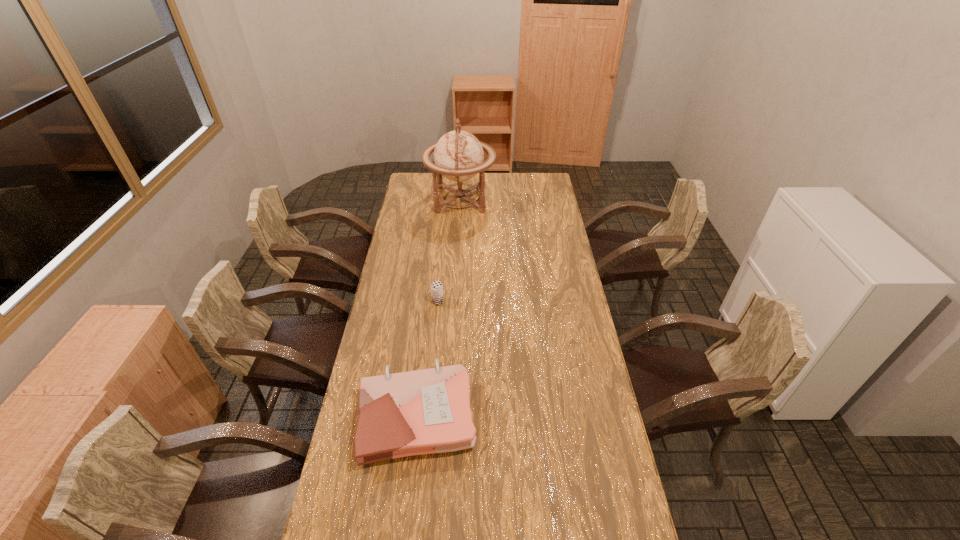
Locate an element on the screen. object that is the second closest one to the globe is located at coordinates (427, 411).

Locate an element on the screen. vacant region that satisfies the following two spatial constraints: 1. on the back side of the nearest object; 2. on the right side of the second farthest object is located at coordinates (430, 301).

Identify the location of vacant position in the image that satisfies the following two spatial constraints: 1. at the front of the farthest object showing Africa; 2. on the front side of the phonebook. (447, 415).